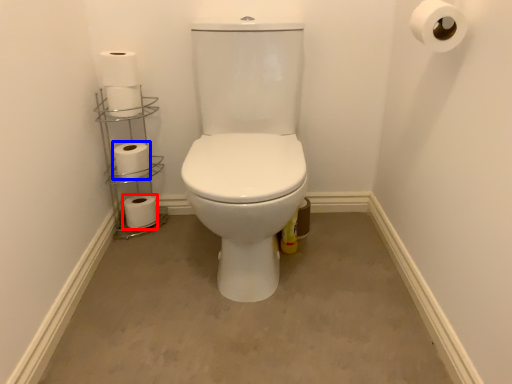
Question: Which object is closer to the camera taking this photo, toilet paper (highlighted by a red box) or toilet paper (highlighted by a blue box)?

Choices:
 (A) toilet paper
 (B) toilet paper

Answer: (B)